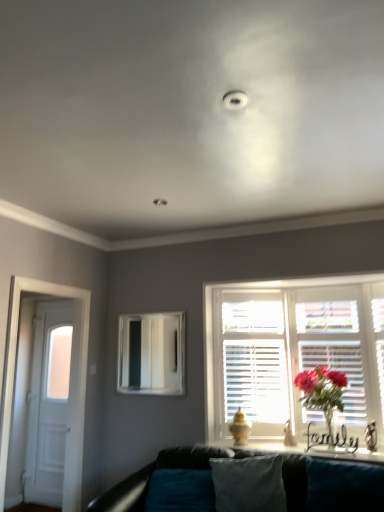
Question: Is white wooden door at left taller than white wooden shutters at center?

Choices:
 (A) yes
 (B) no

Answer: (A)

Question: Is white wooden door at left shorter than white wooden shutters at center?

Choices:
 (A) yes
 (B) no

Answer: (B)

Question: Is the depth of white wooden door at left greater than that of white wooden shutters at center?

Choices:
 (A) yes
 (B) no

Answer: (B)

Question: Can you confirm if white wooden door at left is smaller than white wooden shutters at center?

Choices:
 (A) no
 (B) yes

Answer: (B)

Question: Does white wooden door at left have a lesser width compared to white wooden shutters at center?

Choices:
 (A) no
 (B) yes

Answer: (B)

Question: From the image's perspective, is white glossy door at left positioned above or below matte pink flowers at window?

Choices:
 (A) above
 (B) below

Answer: (B)

Question: From a real-world perspective, is white glossy door at left above or below matte pink flowers at window?

Choices:
 (A) below
 (B) above

Answer: (A)

Question: Is point (64, 368) closer or farther from the camera than point (304, 394)?

Choices:
 (A) farther
 (B) closer

Answer: (A)

Question: In the image, is white glossy door at left on the left side or the right side of matte pink flowers at window?

Choices:
 (A) left
 (B) right

Answer: (A)

Question: Visually, is white wooden door at left positioned to the left or to the right of velvety teal pillow at center?

Choices:
 (A) right
 (B) left

Answer: (B)

Question: Is point (8, 355) positioned closer to the camera than point (266, 509)?

Choices:
 (A) farther
 (B) closer

Answer: (A)

Question: Considering the positions of white wooden door at left and velvety teal pillow at center in the image, is white wooden door at left wider or thinner than velvety teal pillow at center?

Choices:
 (A) thin
 (B) wide

Answer: (B)

Question: From a real-world perspective, relative to velvety teal pillow at center, is white wooden door at left vertically above or below?

Choices:
 (A) above
 (B) below

Answer: (A)

Question: From a real-world perspective, is metallic silver mirror at center positioned above or below teal fabric couch at lower center?

Choices:
 (A) below
 (B) above

Answer: (B)

Question: Is metallic silver mirror at center spatially inside teal fabric couch at lower center, or outside of it?

Choices:
 (A) outside
 (B) inside

Answer: (A)